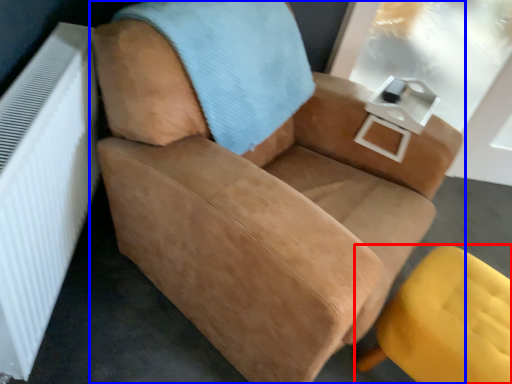
Question: Which object appears closest to the camera in this image, chair (highlighted by a red box) or chair (highlighted by a blue box)?

Choices:
 (A) chair
 (B) chair

Answer: (B)